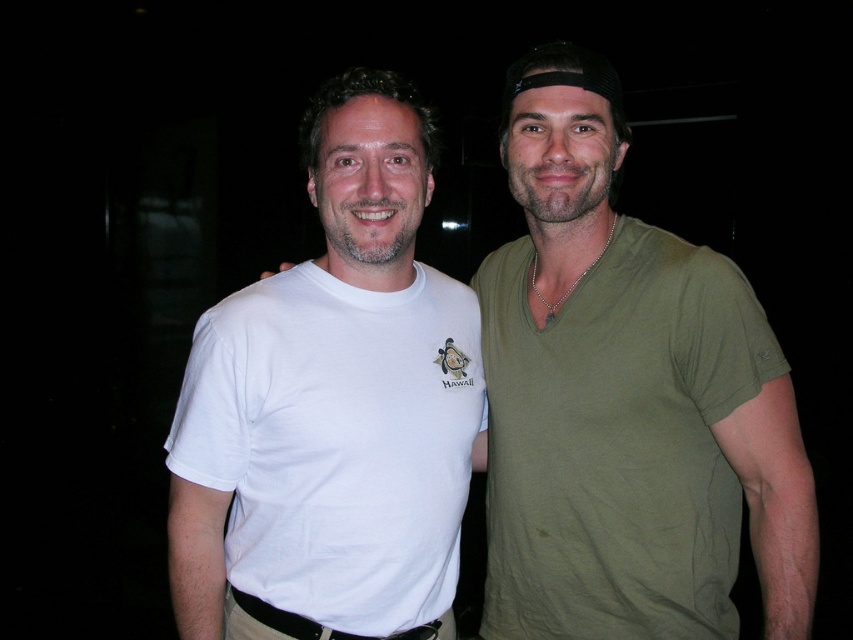
Question: Is white cotton t-shirt at center further to camera compared to white cotton t-shirt at left?

Choices:
 (A) yes
 (B) no

Answer: (B)

Question: Observing the image, what is the correct spatial positioning of white cotton t-shirt at center in reference to white cotton t-shirt at left?

Choices:
 (A) left
 (B) right

Answer: (B)

Question: Among these objects, which one is nearest to the camera?

Choices:
 (A) white cotton t-shirt at center
 (B) white cotton t-shirt at left

Answer: (A)

Question: Which object is closer to the camera taking this photo?

Choices:
 (A) white cotton t-shirt at center
 (B) white cotton t-shirt at left

Answer: (A)

Question: Is white cotton t-shirt at center to the left of white cotton t-shirt at left from the viewer's perspective?

Choices:
 (A) yes
 (B) no

Answer: (B)